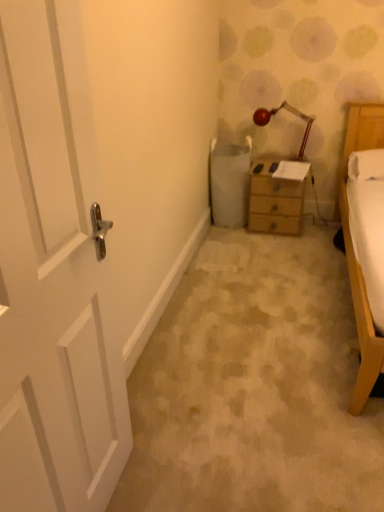
Question: Considering the relative positions of white wooden door at left and wooden nightstand at center in the image provided, is white wooden door at left to the right of wooden nightstand at center from the viewer's perspective?

Choices:
 (A) yes
 (B) no

Answer: (B)

Question: Does white wooden door at left lie in front of wooden nightstand at center?

Choices:
 (A) no
 (B) yes

Answer: (B)

Question: Would you consider white wooden door at left to be distant from wooden nightstand at center?

Choices:
 (A) yes
 (B) no

Answer: (A)

Question: Can you confirm if white wooden door at left is positioned to the left of wooden nightstand at center?

Choices:
 (A) no
 (B) yes

Answer: (B)

Question: Does white wooden door at left have a greater height compared to wooden nightstand at center?

Choices:
 (A) yes
 (B) no

Answer: (A)

Question: Can you confirm if white wooden door at left is thinner than wooden nightstand at center?

Choices:
 (A) no
 (B) yes

Answer: (B)

Question: Considering the relative sizes of matte red lamp at upper right and white wooden door at left in the image provided, is matte red lamp at upper right shorter than white wooden door at left?

Choices:
 (A) no
 (B) yes

Answer: (B)

Question: Is matte red lamp at upper right placed right next to white wooden door at left?

Choices:
 (A) no
 (B) yes

Answer: (A)

Question: From the image's perspective, would you say matte red lamp at upper right is shown under white wooden door at left?

Choices:
 (A) no
 (B) yes

Answer: (A)

Question: Is matte red lamp at upper right turned away from white wooden door at left?

Choices:
 (A) yes
 (B) no

Answer: (B)

Question: Does matte red lamp at upper right come behind white wooden door at left?

Choices:
 (A) yes
 (B) no

Answer: (A)

Question: Considering the relative sizes of matte red lamp at upper right and white wooden door at left in the image provided, is matte red lamp at upper right smaller than white wooden door at left?

Choices:
 (A) yes
 (B) no

Answer: (A)

Question: From the image's perspective, is white wooden door at left below matte red lamp at upper right?

Choices:
 (A) yes
 (B) no

Answer: (A)